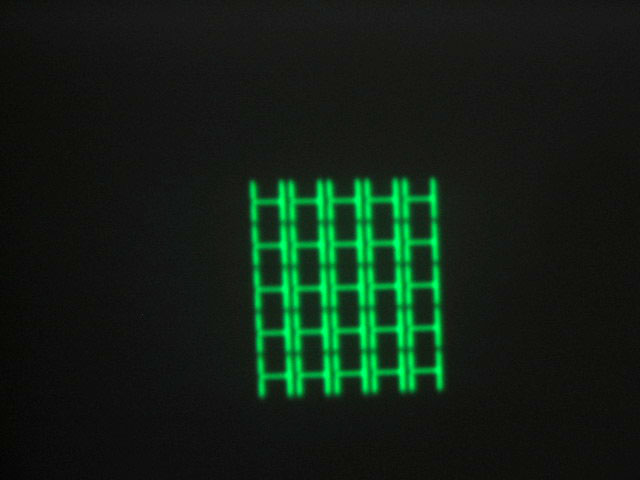
Image resolution: width=640 pixels, height=480 pixels. In order to click on green light in this screenshot , I will do `click(340, 344)`.